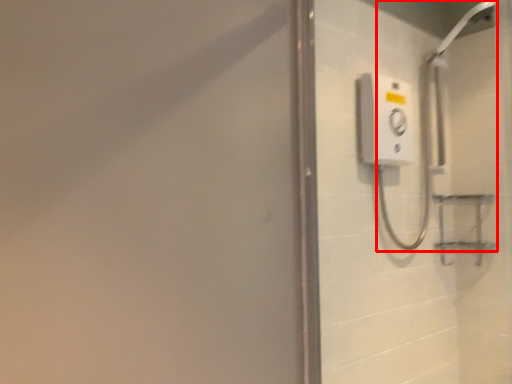
Question: Where is shower (annotated by the red box) located in relation to screen door in the image?

Choices:
 (A) left
 (B) right

Answer: (B)